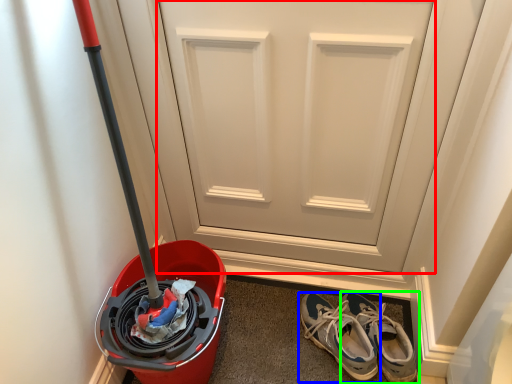
Question: Considering the real-world distances, which object is closest to door (highlighted by a red box)? footwear (highlighted by a blue box) or footwear (highlighted by a green box).

Choices:
 (A) footwear
 (B) footwear

Answer: (A)